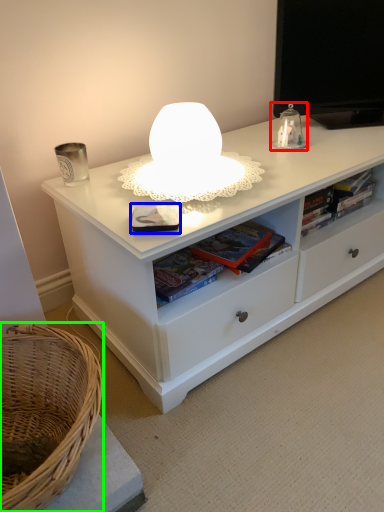
Question: Which object is the farthest from table lamp (highlighted by a red box)? Choose among these: paperback book (highlighted by a blue box) or basket (highlighted by a green box).

Choices:
 (A) paperback book
 (B) basket

Answer: (B)